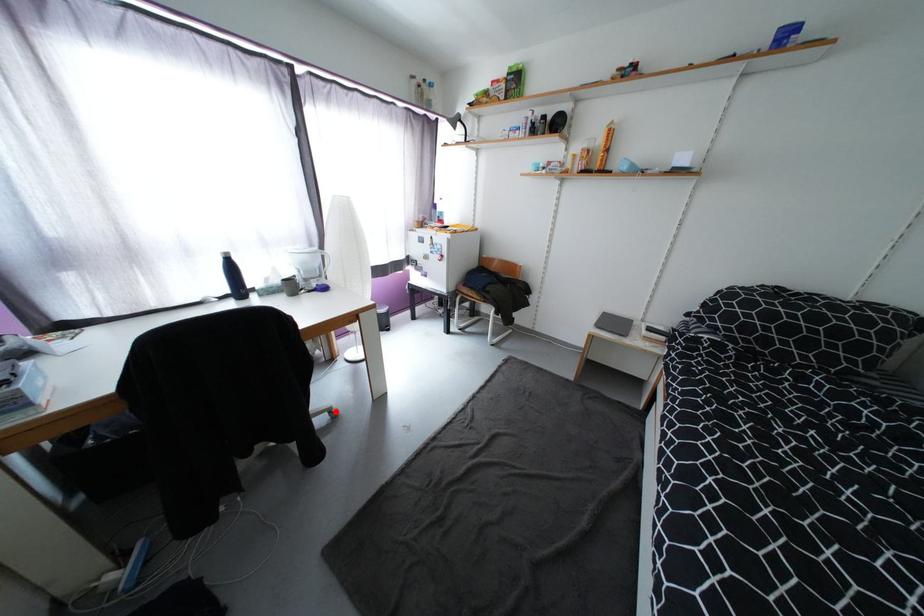
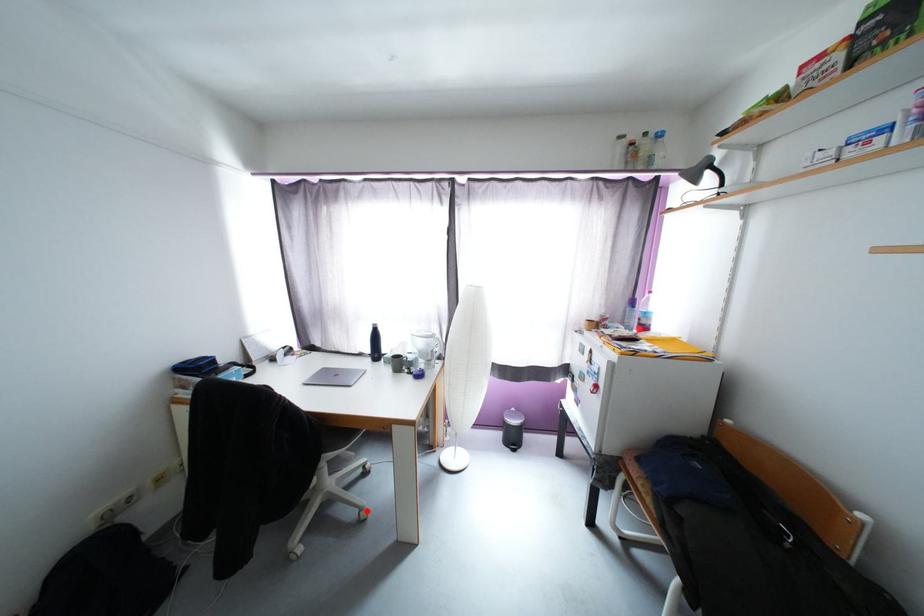
I am providing you with two images of the same scene from different viewpoints. A red point is marked on the first image and another point is marked on the second image. Is the marked point in image1 the same physical position as the marked point in image2?

Yes